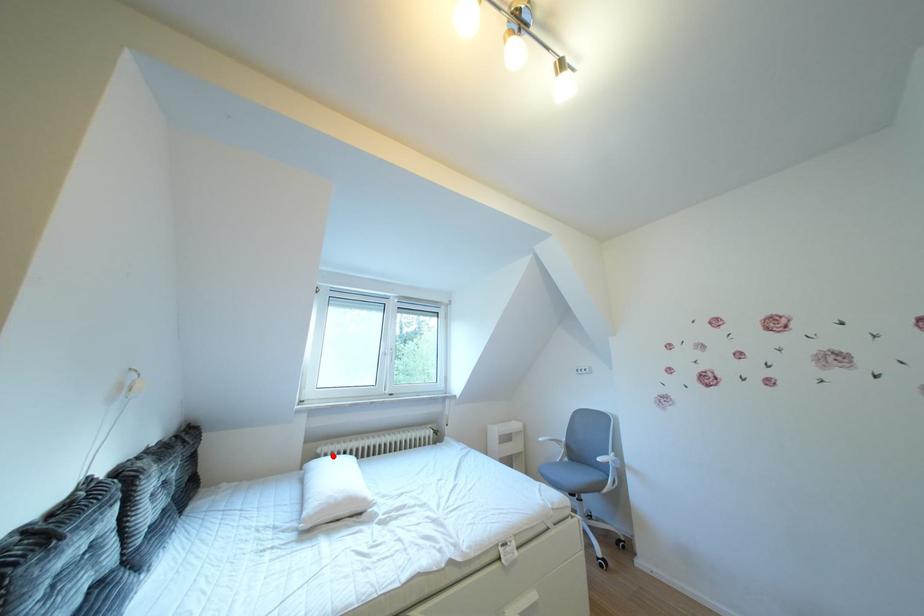
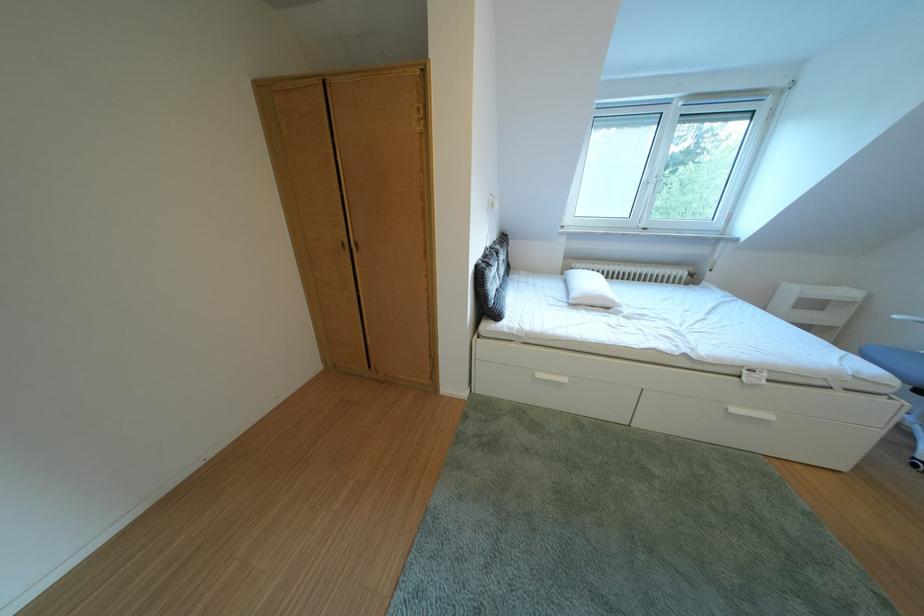
Question: I am providing you with two images of the same scene from different viewpoints. In image1, a red point is highlighted. Considering the same 3D point in image2, which of the following is correct?

Choices:
 (A) It is closer
 (B) It is farther

Answer: (A)